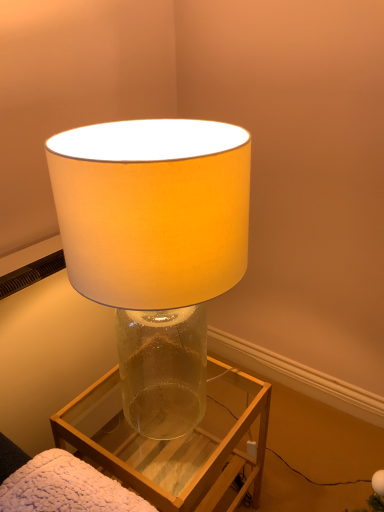
Find the location of a particular element. The height and width of the screenshot is (512, 384). translucent glass lamp at center is located at coordinates (155, 248).

Describe the element at coordinates (155, 248) in the screenshot. The height and width of the screenshot is (512, 384). I see `translucent glass lamp at center` at that location.

In order to face translucent glass lamp at center, should I rotate leftwards or rightwards?

A 4.366 degree turn to the left will do.

Locate an element on the screen. transparent glass vase at center is located at coordinates (170, 444).

Measure the distance between transparent glass vase at center and camera.

29.58 inches.

Describe the element at coordinates (170, 444) in the screenshot. This screenshot has height=512, width=384. I see `transparent glass vase at center` at that location.

Find the location of a particular element. Image resolution: width=384 pixels, height=512 pixels. translucent glass lamp at center is located at coordinates (155, 248).

Which object is positioned more to the right, transparent glass vase at center or translucent glass lamp at center?

transparent glass vase at center.

Does transparent glass vase at center lie behind translucent glass lamp at center?

Yes.

Between point (175, 472) and point (209, 277), which one is positioned in front?

The point (209, 277) is closer.

From the image's perspective, which one is positioned higher, transparent glass vase at center or translucent glass lamp at center?

From the image's view, translucent glass lamp at center is above.

From a real-world perspective, who is located lower, transparent glass vase at center or translucent glass lamp at center?

From a 3D spatial view, transparent glass vase at center is below.

Looking at their sizes, would you say transparent glass vase at center is wider or thinner than translucent glass lamp at center?

transparent glass vase at center is wider than translucent glass lamp at center.

Between transparent glass vase at center and translucent glass lamp at center, which one has less height?

transparent glass vase at center.

Considering the sizes of objects transparent glass vase at center and translucent glass lamp at center in the image provided, who is bigger, transparent glass vase at center or translucent glass lamp at center?

With larger size is translucent glass lamp at center.

Can we say transparent glass vase at center lies outside translucent glass lamp at center?

That's correct, transparent glass vase at center is outside of translucent glass lamp at center.

Is transparent glass vase at center beside translucent glass lamp at center?

No, transparent glass vase at center is not touching translucent glass lamp at center.

Is transparent glass vase at center oriented towards translucent glass lamp at center?

No, transparent glass vase at center does not turn towards translucent glass lamp at center.

How many degrees apart are the facing directions of transparent glass vase at center and translucent glass lamp at center?

They differ by 89.7 degrees in their facing directions.

Based on the photo, how much distance is there between transparent glass vase at center and translucent glass lamp at center?

transparent glass vase at center and translucent glass lamp at center are 6.59 inches apart.

The width and height of the screenshot is (384, 512). I want to click on lamp above the transparent glass vase at center (from a real-world perspective), so click(x=155, y=248).

Is translucent glass lamp at center to the right of transparent glass vase at center from the viewer's perspective?

In fact, translucent glass lamp at center is to the left of transparent glass vase at center.

Is translucent glass lamp at center in front of or behind transparent glass vase at center in the image?

Visually, translucent glass lamp at center is located in front of transparent glass vase at center.

Is point (208, 137) farther from viewer compared to point (91, 399)?

No, it is not.

From the image's perspective, is translucent glass lamp at center beneath transparent glass vase at center?

No, from the image's perspective, translucent glass lamp at center is not beneath transparent glass vase at center.

From a real-world perspective, between translucent glass lamp at center and transparent glass vase at center, who is vertically higher?

translucent glass lamp at center.

In the scene shown: Considering the relative sizes of translucent glass lamp at center and transparent glass vase at center in the image provided, is translucent glass lamp at center wider than transparent glass vase at center?

No, translucent glass lamp at center is not wider than transparent glass vase at center.

Who is taller, translucent glass lamp at center or transparent glass vase at center?

With more height is translucent glass lamp at center.

Who is bigger, translucent glass lamp at center or transparent glass vase at center?

translucent glass lamp at center is bigger.

Is translucent glass lamp at center surrounding transparent glass vase at center?

No, transparent glass vase at center is not a part of translucent glass lamp at center.

Consider the image. Is there a large distance between translucent glass lamp at center and transparent glass vase at center?

That's not correct — translucent glass lamp at center is a little close to transparent glass vase at center.

Is translucent glass lamp at center looking in the opposite direction of transparent glass vase at center?

No, transparent glass vase at center is not at the back of translucent glass lamp at center.

Looking at this image, what's the angular difference between translucent glass lamp at center and transparent glass vase at center's facing directions?

translucent glass lamp at center and transparent glass vase at center are facing 89.7 degrees away from each other.

The height and width of the screenshot is (512, 384). In order to click on lamp on the left of transparent glass vase at center in this screenshot , I will do `click(155, 248)`.

Where is `furniture behind the translucent glass lamp at center`? furniture behind the translucent glass lamp at center is located at coordinates (170, 444).

At what (x,y) coordinates should I click in order to perform the action: click on furniture that appears below the translucent glass lamp at center (from a real-world perspective). Please return your answer as a coordinate pair (x, y). Looking at the image, I should click on (170, 444).